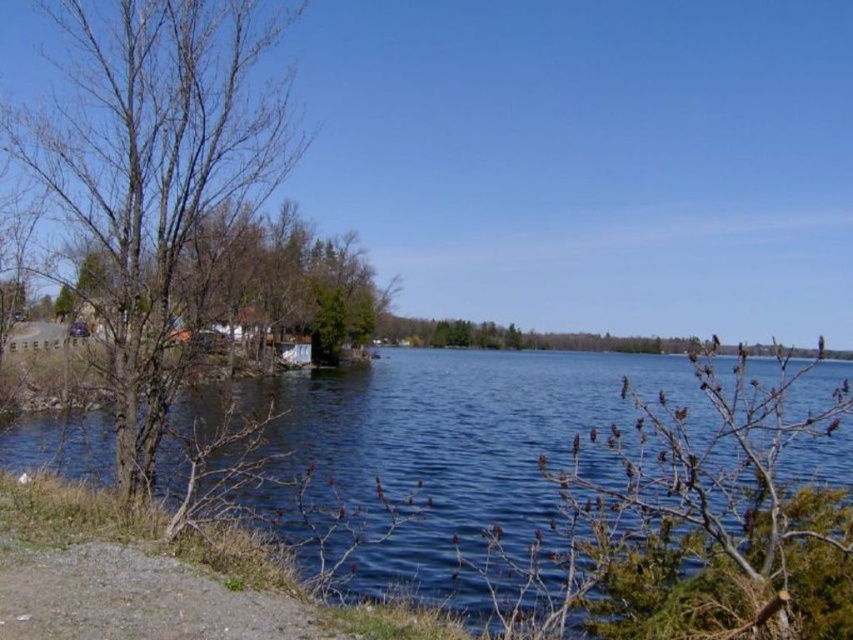
Between point (717, 356) and point (47, 134), which one is positioned in front?

Point (717, 356)

Can you confirm if blue water at center is positioned to the left of bare wood tree at left?

No, blue water at center is not to the left of bare wood tree at left.

Does point (390, 570) lie in front of point (149, 262)?

Yes.

Image resolution: width=853 pixels, height=640 pixels. In order to click on blue water at center in this screenshot , I will do `click(483, 452)`.